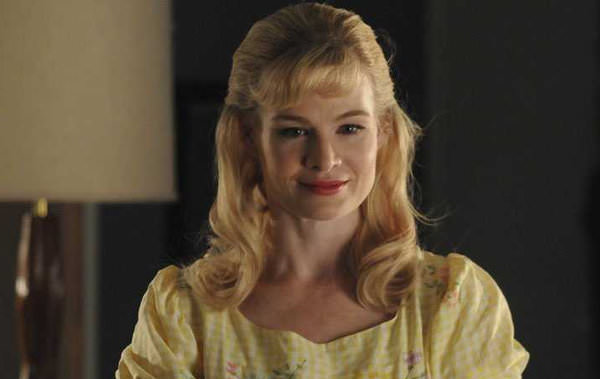
This screenshot has height=379, width=600. Find the location of `walls`. walls is located at coordinates (87, 156), (544, 185).